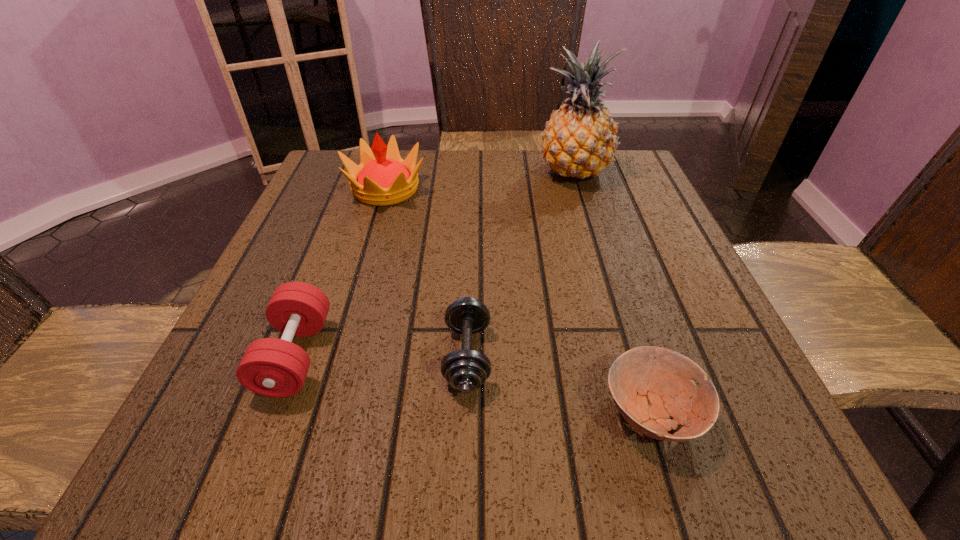
This screenshot has height=540, width=960. In order to click on object located at the far right corner in this screenshot , I will do `click(579, 140)`.

The width and height of the screenshot is (960, 540). I want to click on object present at the near right corner, so click(x=649, y=385).

You are a GUI agent. You are given a task and a screenshot of the screen. Output one action in this format:
    pyautogui.click(x=<x>, y=<y>)
    Task: Click on the blank space at the far edge of the desktop
    
    Given the screenshot: What is the action you would take?
    pyautogui.click(x=573, y=190)

Locate an element on the screen. free space at the near edge of the desktop is located at coordinates (396, 419).

Locate an element on the screen. vacant region at the left edge of the desktop is located at coordinates (308, 233).

In the image, there is a desktop. Identify the location of vacant space at the right edge. (663, 260).

In the image, there is a desktop. In order to click on vacant space at the near left corner in this screenshot , I will do `click(238, 449)`.

At what (x,y) coordinates should I click in order to perform the action: click on free space at the far right corner. Please return your answer as a coordinate pair (x, y). Looking at the image, I should click on (594, 181).

You are a GUI agent. You are given a task and a screenshot of the screen. Output one action in this format:
    pyautogui.click(x=<x>, y=<y>)
    Task: Click on the free space between the tallest object and the fourth shortest object
    
    Given the screenshot: What is the action you would take?
    pyautogui.click(x=480, y=181)

Locate an element on the screen. The height and width of the screenshot is (540, 960). free space between the tallest object and the crown is located at coordinates click(x=480, y=181).